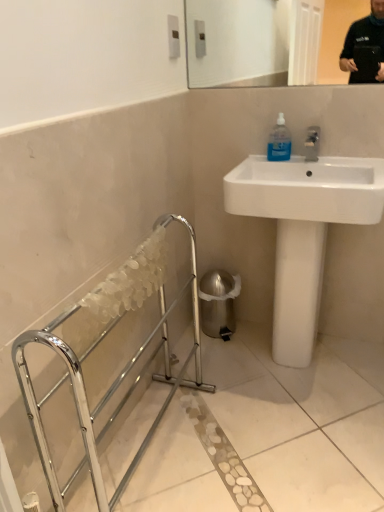
Question: Would you say white glossy sink at upper right is outside chrome metallic balustrade at lower left?

Choices:
 (A) no
 (B) yes

Answer: (B)

Question: Is white glossy sink at upper right next to chrome metallic balustrade at lower left and touching it?

Choices:
 (A) yes
 (B) no

Answer: (B)

Question: From the image's perspective, is white glossy sink at upper right below chrome metallic balustrade at lower left?

Choices:
 (A) yes
 (B) no

Answer: (B)

Question: Is white glossy sink at upper right further to camera compared to chrome metallic balustrade at lower left?

Choices:
 (A) no
 (B) yes

Answer: (B)

Question: From a real-world perspective, is white glossy sink at upper right under chrome metallic balustrade at lower left?

Choices:
 (A) no
 (B) yes

Answer: (A)

Question: Considering the positions of transparent plastic bottle at upper right and white glossy sink at upper right in the image, is transparent plastic bottle at upper right wider or thinner than white glossy sink at upper right?

Choices:
 (A) wide
 (B) thin

Answer: (B)

Question: Would you say transparent plastic bottle at upper right is inside or outside white glossy sink at upper right?

Choices:
 (A) outside
 (B) inside

Answer: (B)

Question: Considering the positions of point (274, 146) and point (284, 290), is point (274, 146) closer or farther from the camera than point (284, 290)?

Choices:
 (A) closer
 (B) farther

Answer: (B)

Question: Is transparent plastic bottle at upper right taller or shorter than white glossy sink at upper right?

Choices:
 (A) short
 (B) tall

Answer: (A)

Question: In the image, is chrome metallic balustrade at lower left positioned in front of or behind shiny metallic trash can at lower right?

Choices:
 (A) front
 (B) behind

Answer: (A)

Question: Is chrome metallic balustrade at lower left spatially inside shiny metallic trash can at lower right, or outside of it?

Choices:
 (A) inside
 (B) outside

Answer: (B)

Question: Is point (71, 356) positioned closer to the camera than point (235, 293)?

Choices:
 (A) farther
 (B) closer

Answer: (B)

Question: Is chrome metallic balustrade at lower left taller or shorter than shiny metallic trash can at lower right?

Choices:
 (A) tall
 (B) short

Answer: (A)

Question: From a real-world perspective, is white glossy sink at upper right above or below chrome metallic balustrade at lower left?

Choices:
 (A) below
 (B) above

Answer: (B)

Question: Does point click(x=291, y=162) appear closer or farther from the camera than point click(x=86, y=437)?

Choices:
 (A) closer
 (B) farther

Answer: (B)